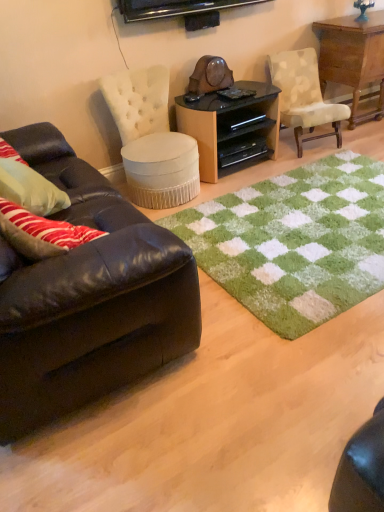
Question: Would you consider white tufted fabric ottoman at center, which ranks as the second chair in right-to-left order, to be distant from black plastic drawer at center, the 1th drawer positioned from the bottom?

Choices:
 (A) no
 (B) yes

Answer: (A)

Question: Is white tufted fabric ottoman at center, which ranks as the second chair in right-to-left order, bigger than black plastic drawer at center, arranged as the second drawer when viewed from the top?

Choices:
 (A) yes
 (B) no

Answer: (A)

Question: Can you confirm if white tufted fabric ottoman at center, which ranks as the second chair in right-to-left order, is positioned to the left of black plastic drawer at center, arranged as the second drawer when viewed from the top?

Choices:
 (A) yes
 (B) no

Answer: (A)

Question: Is white tufted fabric ottoman at center, the first chair positioned from the left, positioned beyond the bounds of black plastic drawer at center, the 1th drawer positioned from the bottom?

Choices:
 (A) yes
 (B) no

Answer: (A)

Question: From a real-world perspective, is white tufted fabric ottoman at center, the first chair positioned from the left, over black plastic drawer at center, arranged as the second drawer when viewed from the top?

Choices:
 (A) yes
 (B) no

Answer: (A)

Question: From the image's perspective, is white tufted fabric ottoman at center, the first chair positioned from the left, located above black plastic drawer at center, arranged as the second drawer when viewed from the top?

Choices:
 (A) no
 (B) yes

Answer: (A)

Question: Does green shaggy rug at center lie in front of white tufted fabric ottoman at center, which ranks as the second chair in right-to-left order?

Choices:
 (A) yes
 (B) no

Answer: (A)

Question: Considering the relative sizes of green shaggy rug at center and white tufted fabric ottoman at center, the first chair positioned from the left, in the image provided, is green shaggy rug at center thinner than white tufted fabric ottoman at center, the first chair positioned from the left,?

Choices:
 (A) yes
 (B) no

Answer: (B)

Question: Would you say white tufted fabric ottoman at center, the first chair positioned from the left, is part of green shaggy rug at center's contents?

Choices:
 (A) yes
 (B) no

Answer: (B)

Question: Is green shaggy rug at center touching white tufted fabric ottoman at center, the first chair positioned from the left?

Choices:
 (A) yes
 (B) no

Answer: (B)

Question: Can you confirm if green shaggy rug at center is positioned to the left of white tufted fabric ottoman at center, the first chair positioned from the left?

Choices:
 (A) yes
 (B) no

Answer: (B)

Question: From a real-world perspective, is green shaggy rug at center on top of white tufted fabric ottoman at center, the first chair positioned from the left?

Choices:
 (A) yes
 (B) no

Answer: (B)

Question: Is black plastic drawer at center, which is the 1th drawer from top to bottom, oriented away from shiny brown leather couch at left?

Choices:
 (A) yes
 (B) no

Answer: (B)